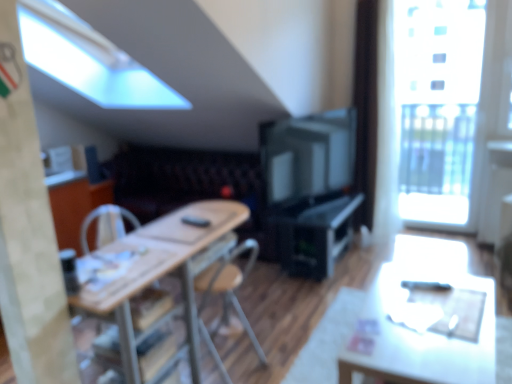
I want to click on vacant space in between black plastic computer desk at center and wooden chair at center, which appears as the 2th chair when viewed from the back, so click(278, 306).